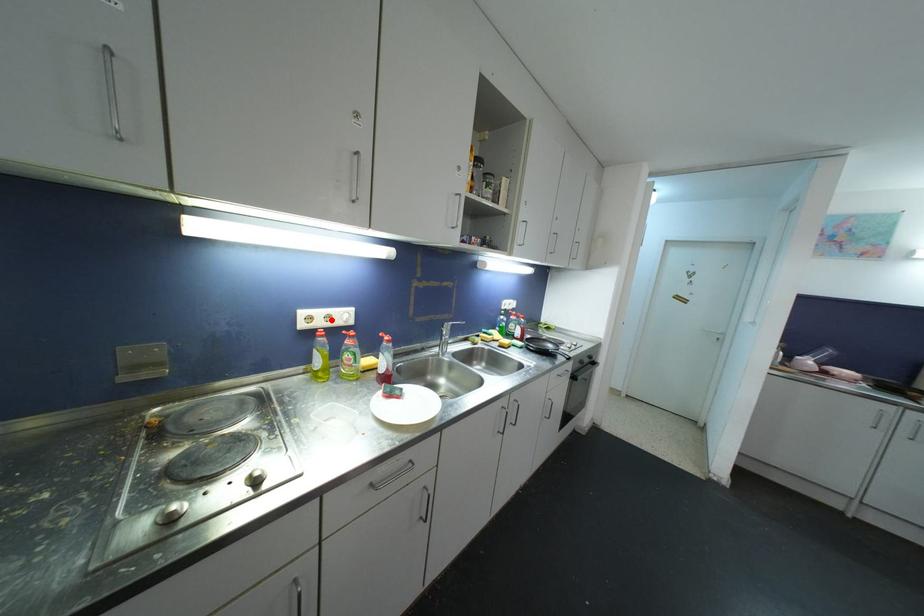
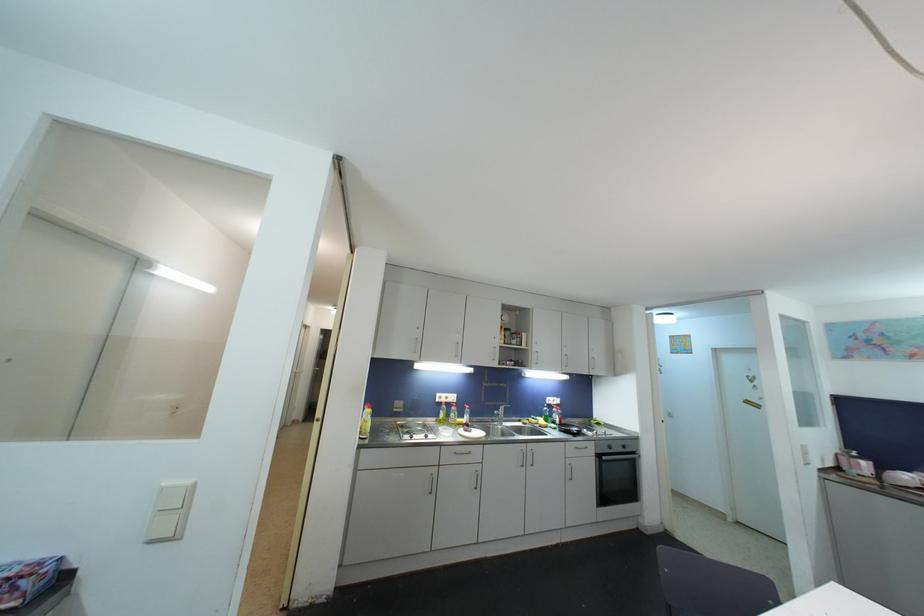
In the second image, find the point that corresponds to the highlighted location in the first image.

(450, 400)